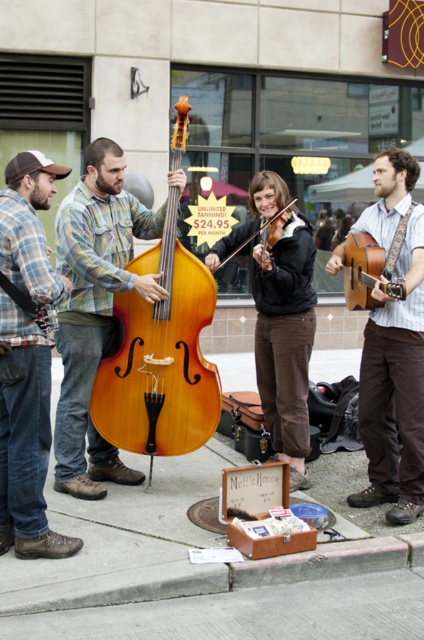
Question: Considering the real-world distances, which object is closest to the striped cotton shirt at center?

Choices:
 (A) plaid flannel shirt at left
 (B) wooden suitcase at center

Answer: (B)

Question: Which point is closer to the camera?

Choices:
 (A) striped cotton shirt at center
 (B) plaid flannel shirt at left

Answer: (B)

Question: Is the position of matte plaid shirt at center less distant than that of natural wood cello at left?

Choices:
 (A) no
 (B) yes

Answer: (B)

Question: Can you confirm if striped cotton shirt at center is smaller than shiny brown violin at center?

Choices:
 (A) yes
 (B) no

Answer: (B)

Question: Does natural wood cello at left appear on the left side of striped cotton shirt at center?

Choices:
 (A) no
 (B) yes

Answer: (B)

Question: Which object is the closest to the wooden suitcase at center?

Choices:
 (A) striped cotton shirt at center
 (B) shiny brown violin at center
 (C) plaid flannel shirt at left

Answer: (C)